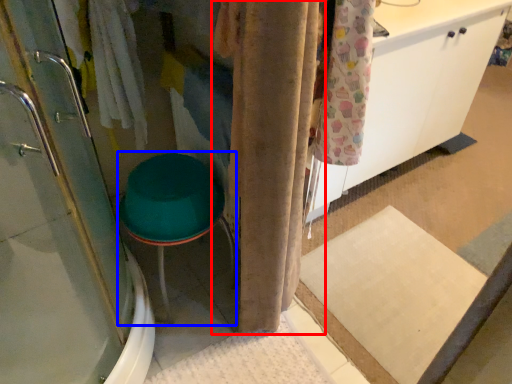
Question: Which of the following is the closest to the observer, curtain (highlighted by a red box) or step stool (highlighted by a blue box)?

Choices:
 (A) curtain
 (B) step stool

Answer: (A)